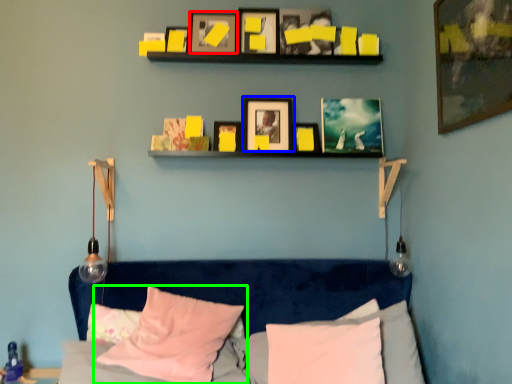
Question: Estimate the real-world distances between objects in this image. Which object is closer to picture frame (highlighted by a red box), picture frame (highlighted by a blue box) or pillow (highlighted by a green box)?

Choices:
 (A) picture frame
 (B) pillow

Answer: (A)